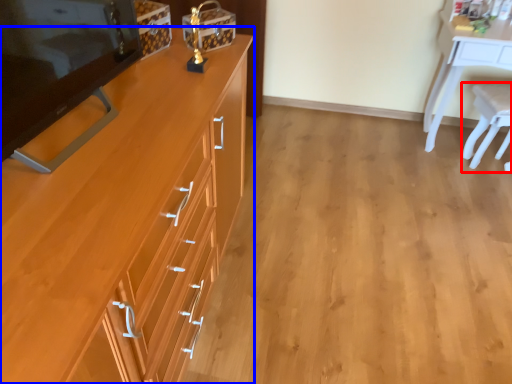
Question: Which point is closer to the camera, chair (highlighted by a red box) or cabinetry (highlighted by a blue box)?

Choices:
 (A) chair
 (B) cabinetry

Answer: (B)